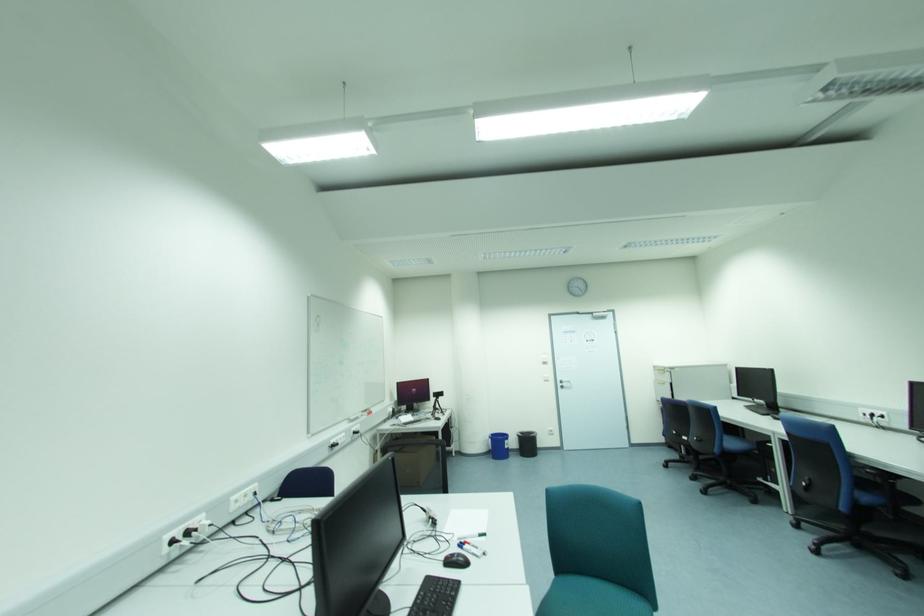
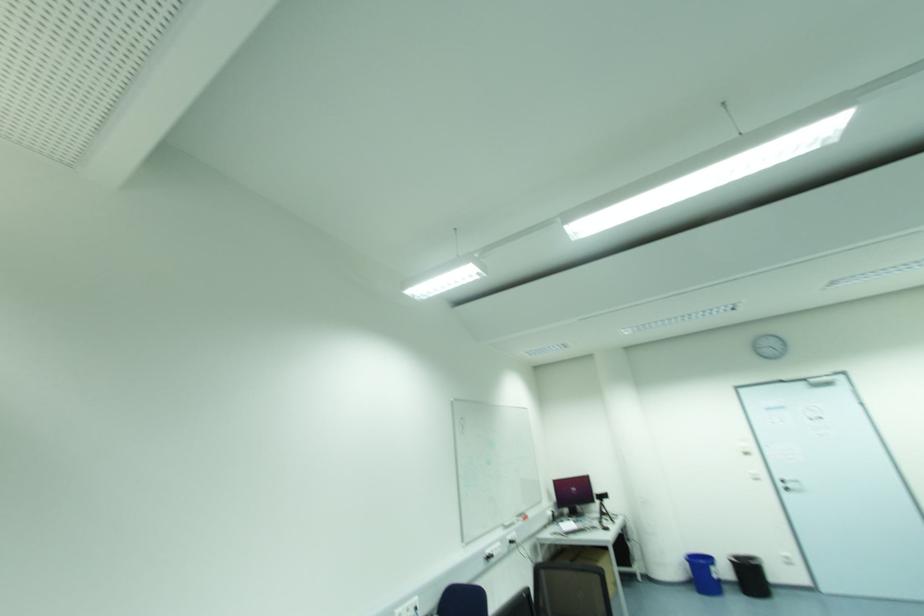
The point at (565, 385) is marked in the first image. Where is the corresponding point in the second image?

(789, 485)